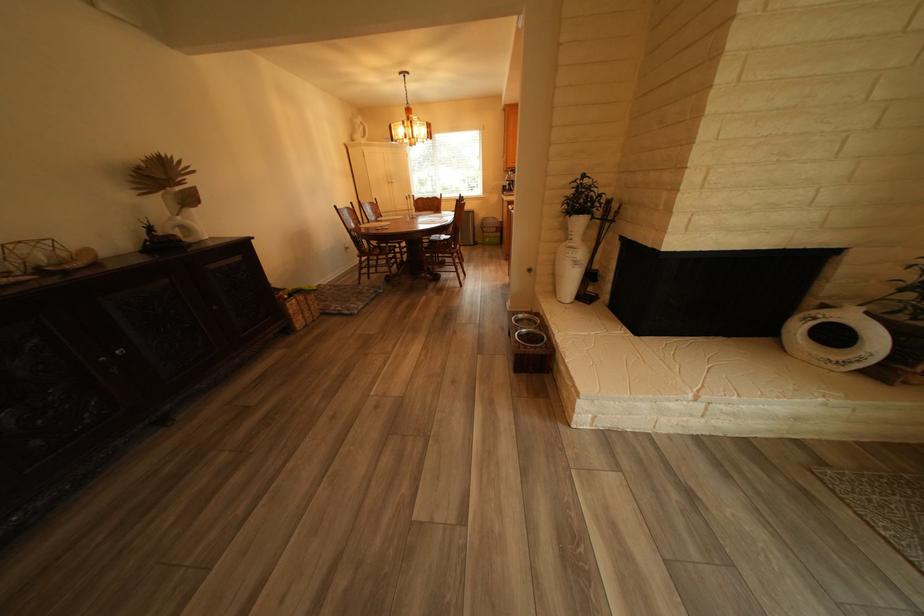
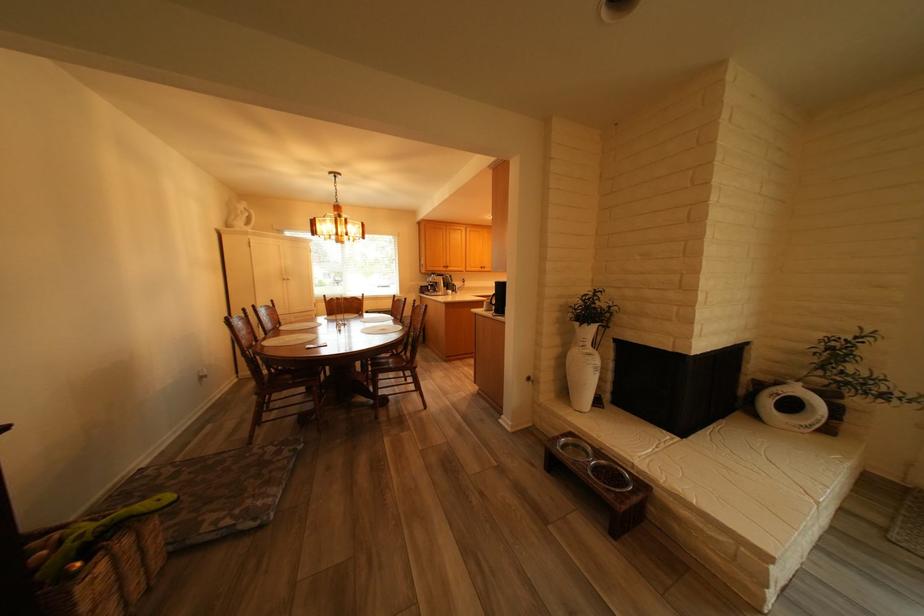
In the second image, find the point that corresponds to point (578, 245) in the first image.

(590, 352)